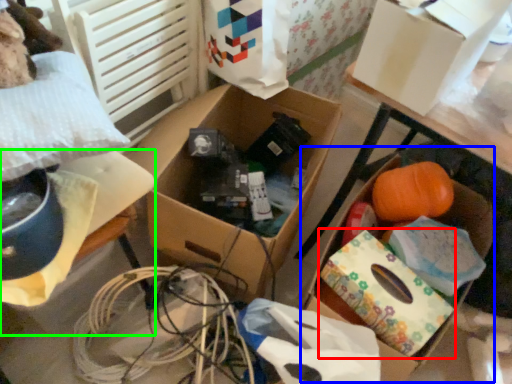
Question: Estimate the real-world distances between objects in this image. Which object is farther from cardboard box (highlighted by a red box), storage box (highlighted by a blue box) or storage box (highlighted by a green box)?

Choices:
 (A) storage box
 (B) storage box

Answer: (B)